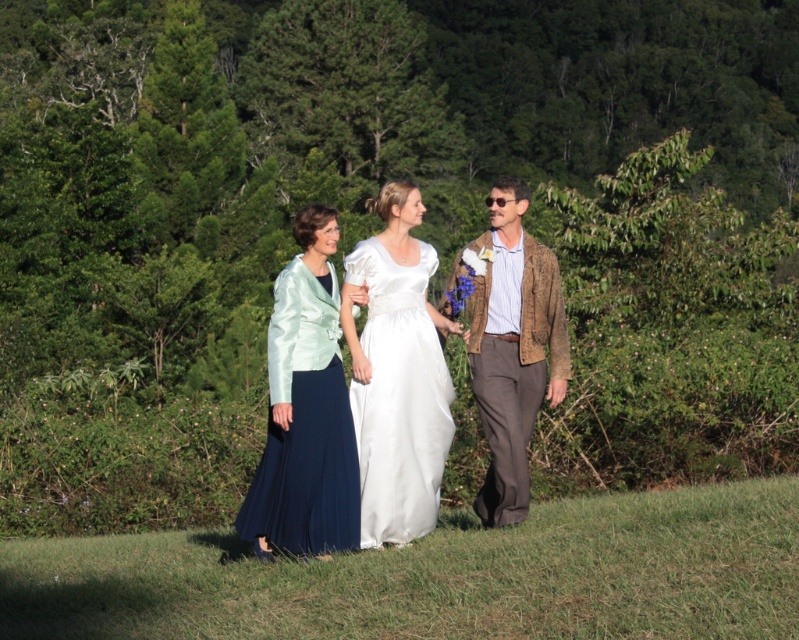
You are planning to take a photo of the white satin dress at center and the brown textured jacket at right. Which object should you focus on first if you want to capture both in the same frame without moving the camera?

The white satin dress at center has a lesser height compared to the brown textured jacket at right, so you should focus on the brown textured jacket at right first to ensure both are in focus since it is taller and might be further away.

You are standing in the grassy area and see the satin white dress at center and the brown textured jacket at right. Which one is more to the left?

The satin white dress at center is more to the left than the brown textured jacket at right.